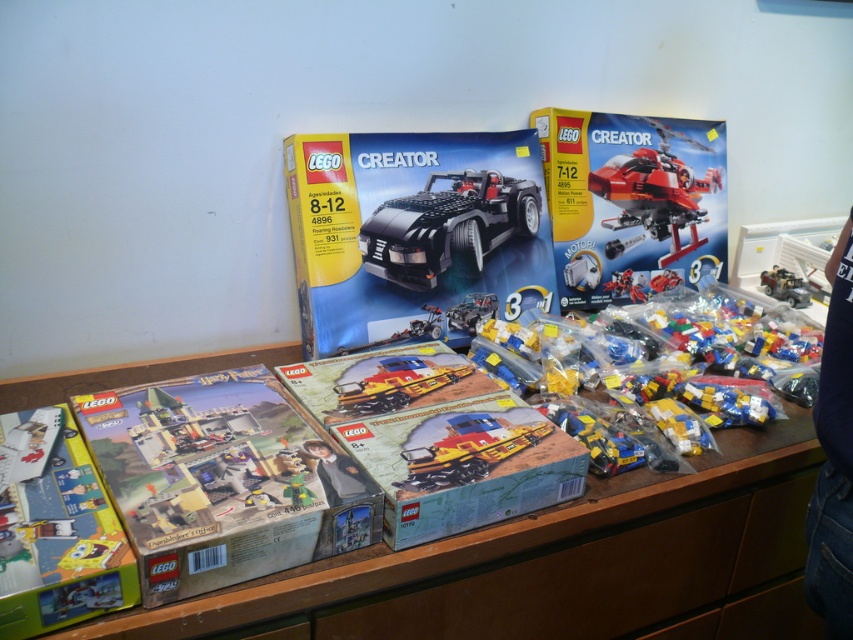
This screenshot has height=640, width=853. Describe the element at coordinates (415, 234) in the screenshot. I see `matte black car at center` at that location.

Who is more distant from viewer, (x=523, y=291) or (x=386, y=403)?

Positioned behind is point (x=523, y=291).

I want to click on matte black car at center, so click(415, 234).

Is matte brown train at center smaller than shiny red plastic toy car at upper right?

No.

Who is more forward, (463, 397) or (676, 241)?

Point (463, 397) is more forward.

Who is more forward, (567, 467) or (670, 209)?

Point (567, 467) is more forward.

Where is `matte brown train at center`? The height and width of the screenshot is (640, 853). matte brown train at center is located at coordinates (438, 440).

Can you confirm if cartoonish matte board game at lower left is positioned to the left of black matte car at center?

Correct, you'll find cartoonish matte board game at lower left to the left of black matte car at center.

Locate an element on the screen. The height and width of the screenshot is (640, 853). cartoonish matte board game at lower left is located at coordinates (55, 529).

The height and width of the screenshot is (640, 853). I want to click on cartoonish matte board game at lower left, so click(x=55, y=529).

The image size is (853, 640). What are the coordinates of `cartoonish matte board game at lower left` in the screenshot? It's located at (55, 529).